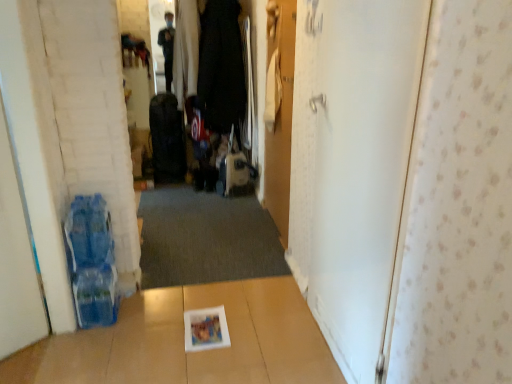
Question: Is dark gray carpet at center not near white matte door at right, the 1th door when ordered from right to left?

Choices:
 (A) no
 (B) yes

Answer: (B)

Question: Could you tell me if dark gray carpet at center is facing white matte door at right, which is the third door in left-to-right order?

Choices:
 (A) yes
 (B) no

Answer: (B)

Question: From the image's perspective, would you say dark gray carpet at center is shown under white matte door at right, which is the third door in left-to-right order?

Choices:
 (A) yes
 (B) no

Answer: (A)

Question: From the image's perspective, is dark gray carpet at center above white matte door at right, the 1th door when ordered from right to left?

Choices:
 (A) no
 (B) yes

Answer: (A)

Question: Is white matte door at right, which is the third door in left-to-right order, at the back of dark gray carpet at center?

Choices:
 (A) yes
 (B) no

Answer: (B)

Question: Does dark gray carpet at center have a lesser width compared to white matte door at right, the 1th door when ordered from right to left?

Choices:
 (A) yes
 (B) no

Answer: (B)

Question: Can you confirm if matte black suitcase at center, which is counted as the second luggage, starting from the left, is bigger than black fabric suitcase at center, the second luggage when ordered from right to left?

Choices:
 (A) no
 (B) yes

Answer: (A)

Question: Is matte black suitcase at center, arranged as the 1th luggage when viewed from the right, wider than black fabric suitcase at center, the 1th luggage in the left-to-right sequence?

Choices:
 (A) yes
 (B) no

Answer: (A)

Question: From a real-world perspective, is matte black suitcase at center, which is counted as the second luggage, starting from the left, located beneath black fabric suitcase at center, the 1th luggage in the left-to-right sequence?

Choices:
 (A) yes
 (B) no

Answer: (A)

Question: Is black fabric suitcase at center, the second luggage when ordered from right to left, located within matte black suitcase at center, which is counted as the second luggage, starting from the left?

Choices:
 (A) yes
 (B) no

Answer: (B)

Question: From a real-world perspective, is matte black suitcase at center, arranged as the 1th luggage when viewed from the right, positioned over black fabric suitcase at center, the second luggage when ordered from right to left, based on gravity?

Choices:
 (A) yes
 (B) no

Answer: (B)

Question: Is matte black suitcase at center, arranged as the 1th luggage when viewed from the right, positioned behind black fabric suitcase at center, the 1th luggage in the left-to-right sequence?

Choices:
 (A) no
 (B) yes

Answer: (A)

Question: Does white matte door at left, acting as the third door starting from the right, lie in front of dark gray carpet at center?

Choices:
 (A) yes
 (B) no

Answer: (A)